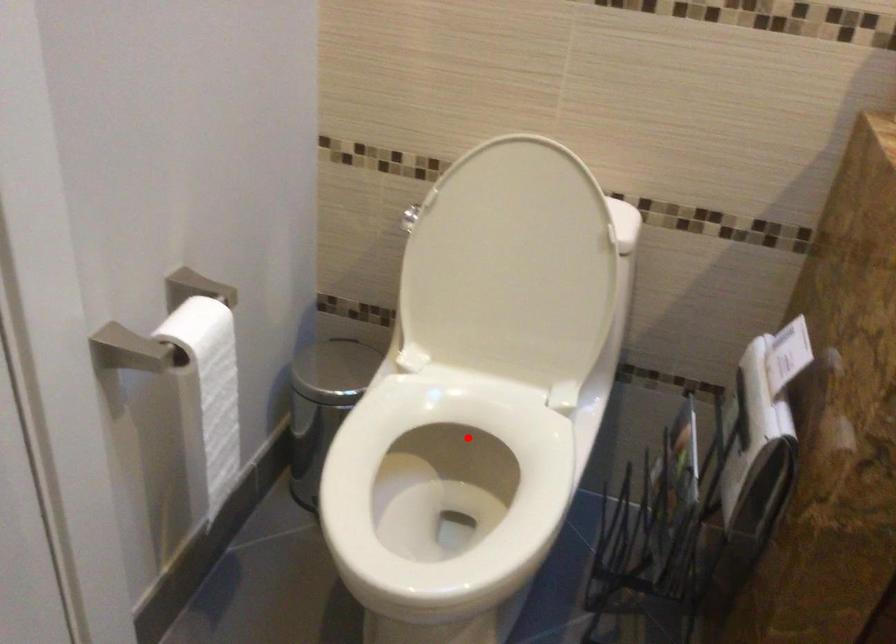
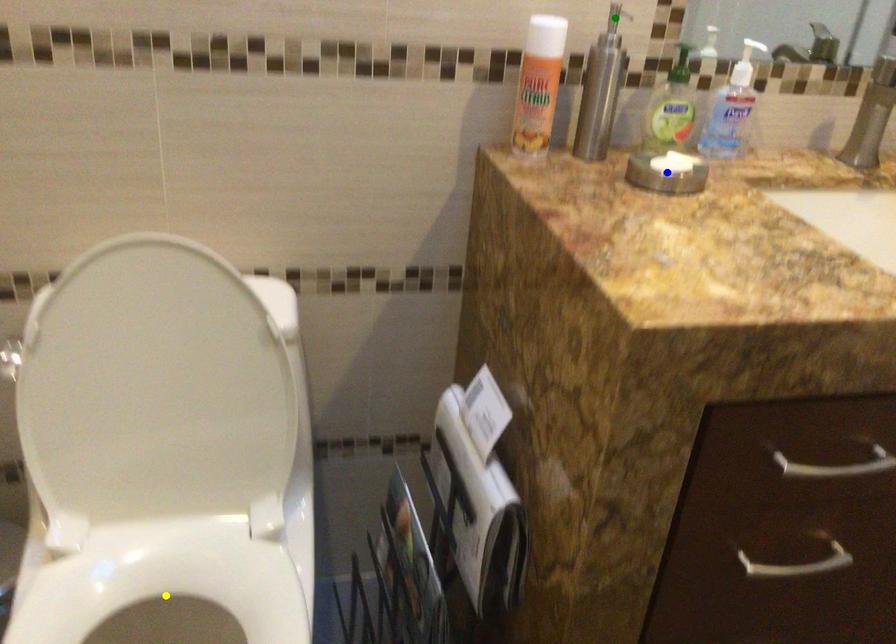
Question: I am providing you with two images of the same scene from different viewpoints. A red point is marked on the first image. You are given multiple points on the second image. Which spot in image 2 lines up with the point in image 1?

Choices:
 (A) blue point
 (B) yellow point
 (C) green point

Answer: (B)